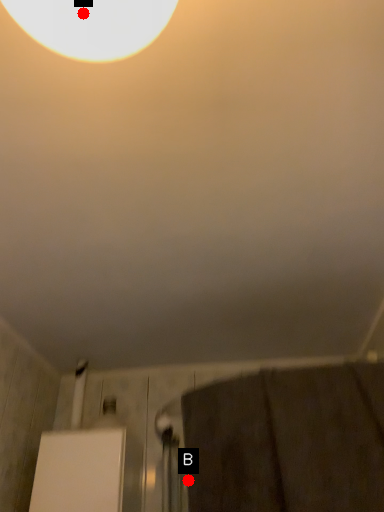
Question: Two points are circled on the image, labeled by A and B beside each circle. Which of the following is the closest to the observer?

Choices:
 (A) A is closer
 (B) B is closer

Answer: (A)